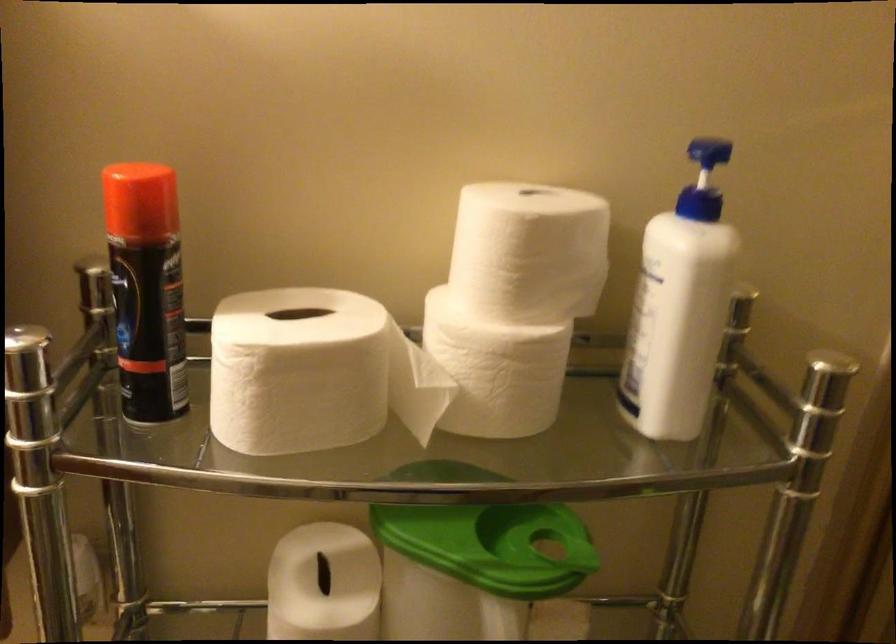
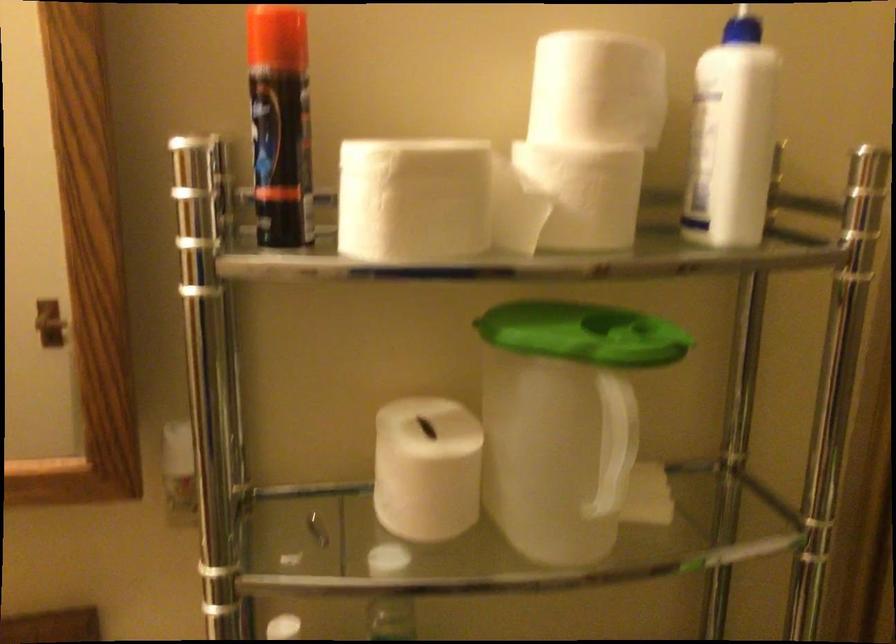
In the second image, find the point that corresponds to point 521,250 in the first image.

(597, 89)